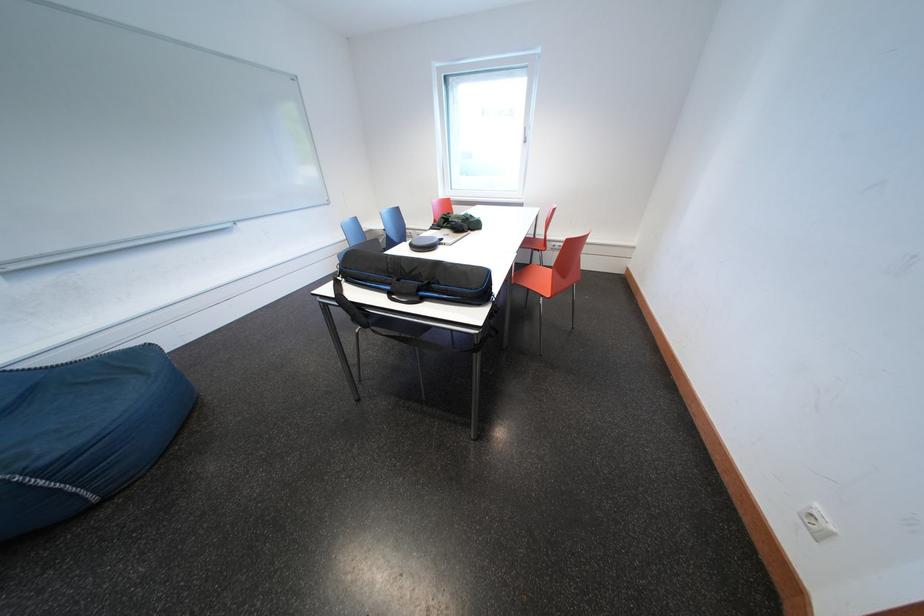
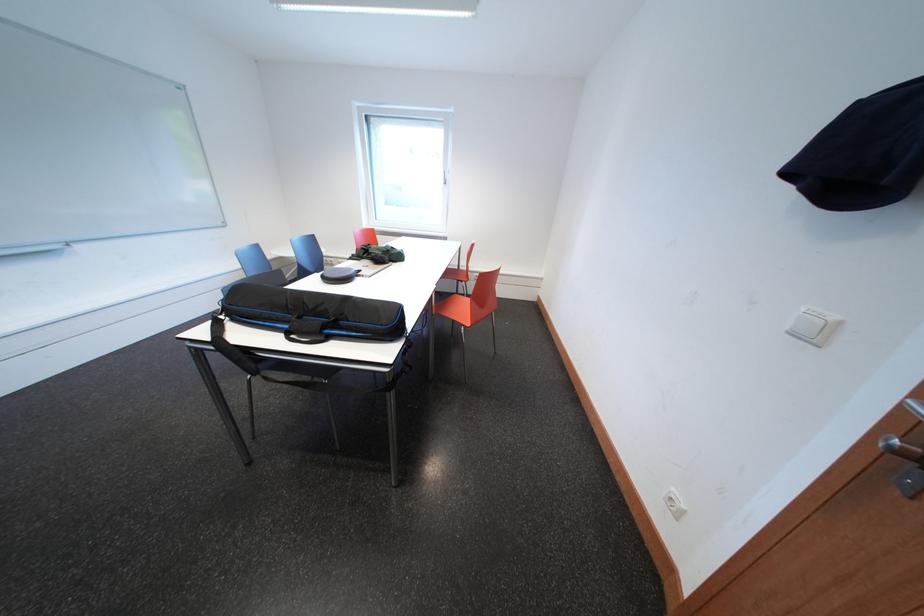
Question: Based on the continuous images, in which direction is the camera rotating? Reply with the corresponding letter.

Choices:
 (A) Left
 (B) Right
 (C) Up
 (D) Down

Answer: (B)